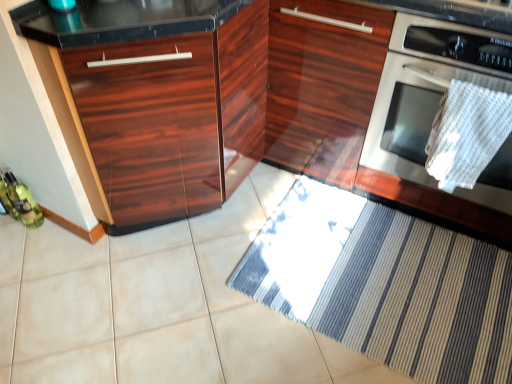
Image resolution: width=512 pixels, height=384 pixels. In order to click on free space in front of glossy wood cabinet at left, which ranks as the second cabinetry in right-to-left order in this screenshot , I will do `click(149, 321)`.